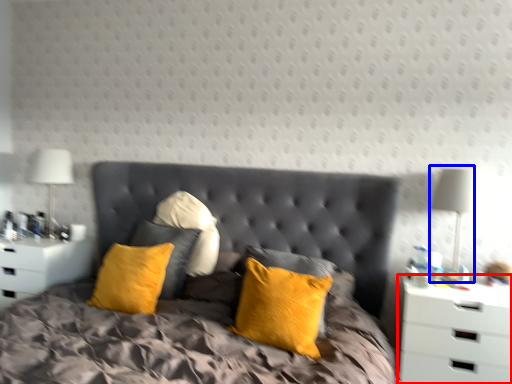
Question: Which object appears farthest to the camera in this image, nightstand (highlighted by a red box) or bedside lamp (highlighted by a blue box)?

Choices:
 (A) nightstand
 (B) bedside lamp

Answer: (B)